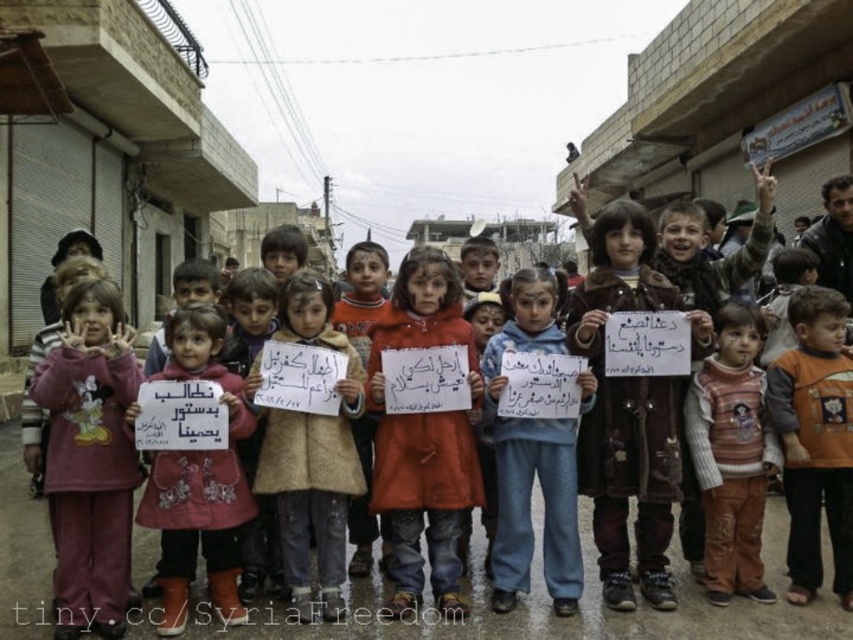
You are a photographer trying to capture a clear shot of both the point at (265,483) and the point at (566,611) in the image. Since you want to focus on both points equally, which point should you adjust your camera focus to prioritize to ensure both are sharp?

You should prioritize focusing on point (566,611) because it is farther away from the viewer compared to point (265,483). By focusing on the farther point, the depth of field will naturally include the closer point as well, ensuring both are in focus.

You are a photographer trying to capture a closeup of the denim jeans at center and striped sweater at center. Which one should you focus on first to ensure both are in focus?

The denim jeans at center is above the striped sweater at center, so you should focus on the denim jeans at center first to ensure both are in focus.